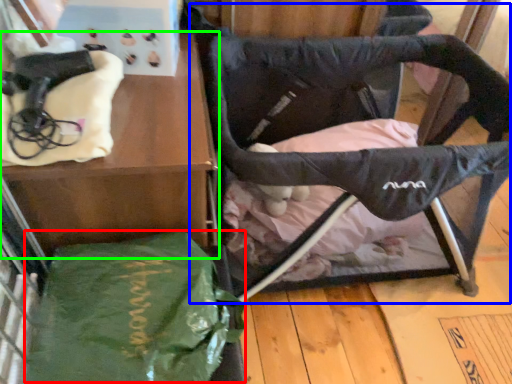
Question: Which object is the farthest from tote bag (highlighted by a red box)? Choose among these: swivel chair (highlighted by a blue box) or furniture (highlighted by a green box).

Choices:
 (A) swivel chair
 (B) furniture

Answer: (A)